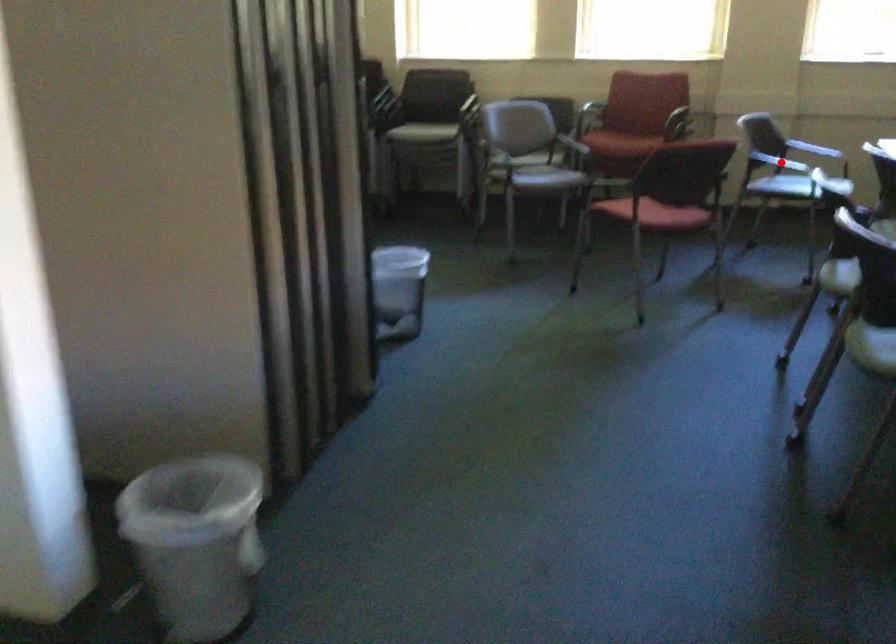
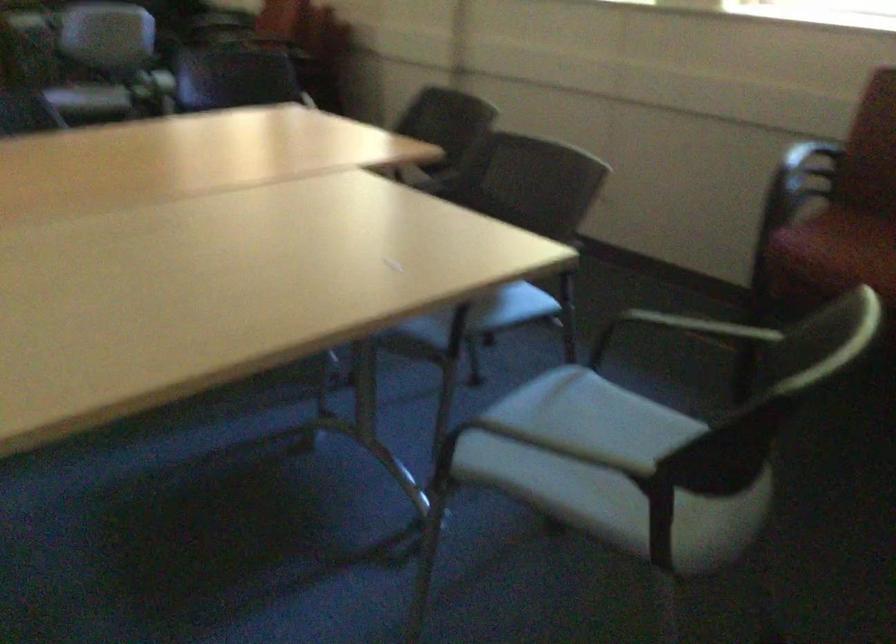
Question: I am providing you with two images of the same scene from different viewpoints. A red point is marked on the first image. Is the red point's position out of view in image 2?

Choices:
 (A) Yes
 (B) No

Answer: (A)